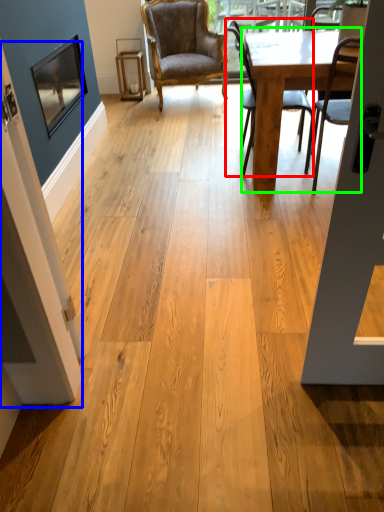
Question: Considering the real-world distances, which object is closest to chair (highlighted by a red box)? screen door (highlighted by a blue box) or table (highlighted by a green box).

Choices:
 (A) screen door
 (B) table

Answer: (B)